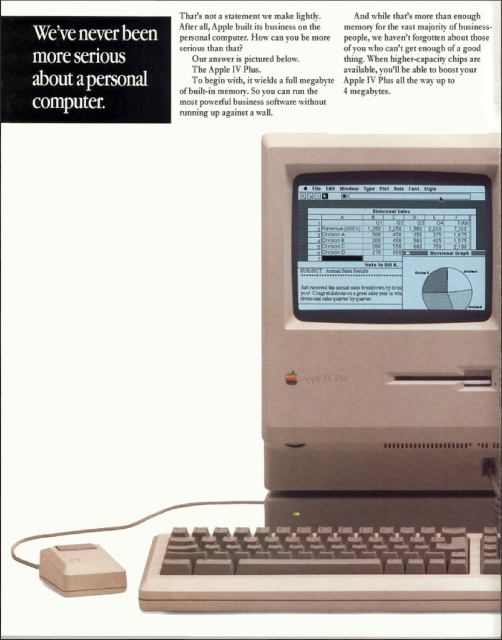
Question: Can you confirm if beige plastic apple iv plus at center is thinner than beige plastic mouse at lower left?

Choices:
 (A) no
 (B) yes

Answer: (A)

Question: Which object is farther from the camera taking this photo?

Choices:
 (A) beige plastic mouse at lower left
 (B) beige plastic apple iv plus at center
 (C) matte plastic monitor at center

Answer: (C)

Question: Which point is closer to the camera taking this photo?

Choices:
 (A) (344, 193)
 (B) (356, 582)
 (C) (294, 349)
 (D) (65, 550)

Answer: (B)

Question: Can you confirm if brown plastic keyboard at lower center is positioned above beige plastic mouse at lower left?

Choices:
 (A) no
 (B) yes

Answer: (B)

Question: Based on their relative distances, which object is nearer to the beige plastic apple iv plus at center?

Choices:
 (A) matte plastic monitor at center
 (B) brown plastic keyboard at lower center

Answer: (A)

Question: Does matte plastic monitor at center appear over brown plastic keyboard at lower center?

Choices:
 (A) yes
 (B) no

Answer: (A)